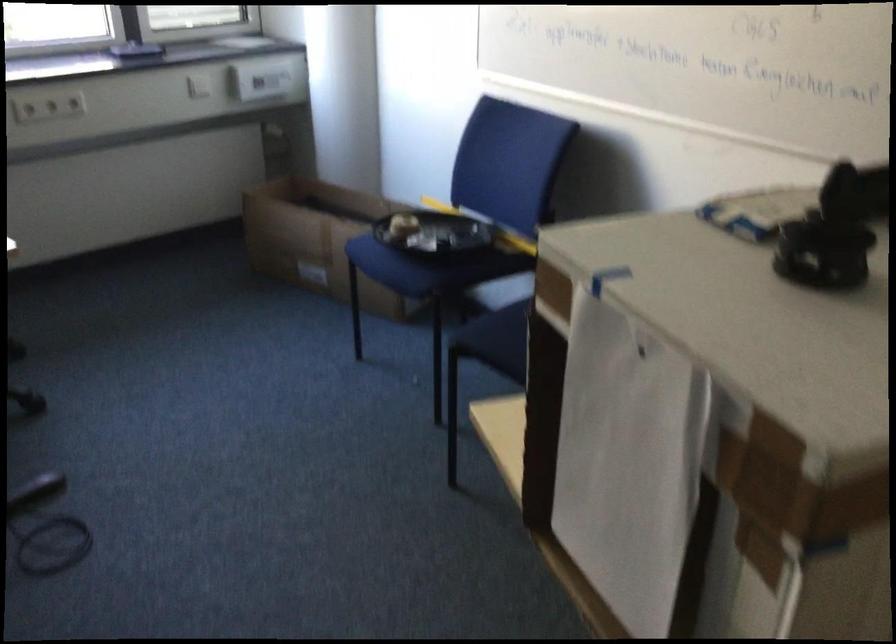
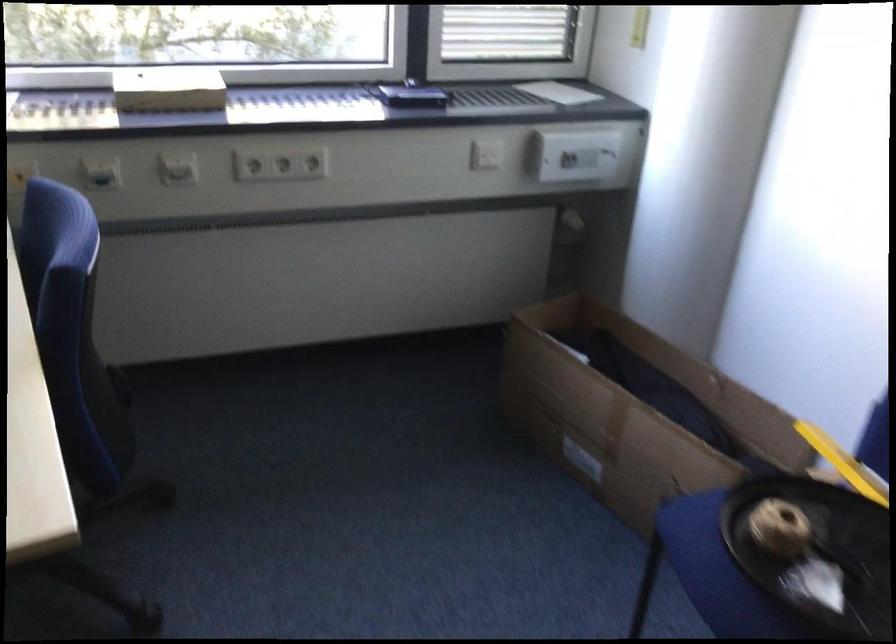
In the second image, find the point that corresponds to point 362,243 in the first image.

(695, 527)